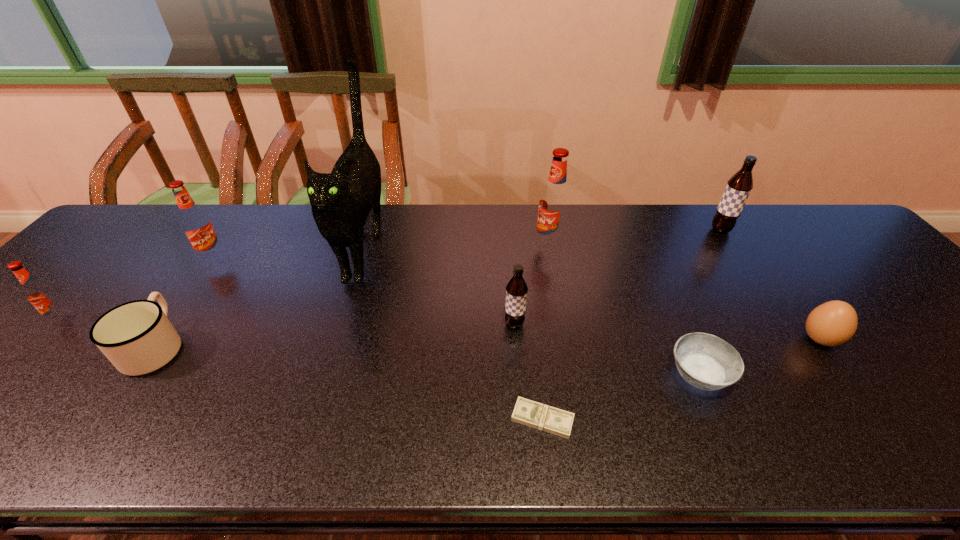
Locate an element on the screen. object located in the near edge section of the desktop is located at coordinates (527, 412).

Find the location of `object that is at the left edge`. object that is at the left edge is located at coordinates (42, 296).

The width and height of the screenshot is (960, 540). I want to click on vacant space at the far edge, so click(x=756, y=211).

This screenshot has height=540, width=960. Find the location of `free space at the near edge`. free space at the near edge is located at coordinates (857, 427).

Identify the location of vacant space at the left edge of the desktop. (40, 342).

Where is `vacant area at the right edge`? This screenshot has width=960, height=540. vacant area at the right edge is located at coordinates (858, 301).

The width and height of the screenshot is (960, 540). Identify the location of vacant space at the far left corner of the desktop. (165, 220).

The image size is (960, 540). I want to click on vacant space at the far right corner of the desktop, so click(813, 215).

Locate an element on the screen. This screenshot has height=540, width=960. free space between the money and the leftmost red root beer is located at coordinates (303, 369).

Find the location of a particular element. The image size is (960, 540). empty space between the rightmost root beer and the leftmost red root beer is located at coordinates (393, 275).